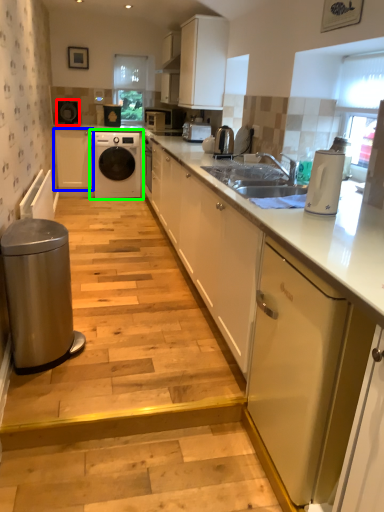
Question: Estimate the real-world distances between objects in this image. Which object is closer to appliance (highlighted by a red box), cabinetry (highlighted by a blue box) or washing machine (highlighted by a green box)?

Choices:
 (A) cabinetry
 (B) washing machine

Answer: (A)